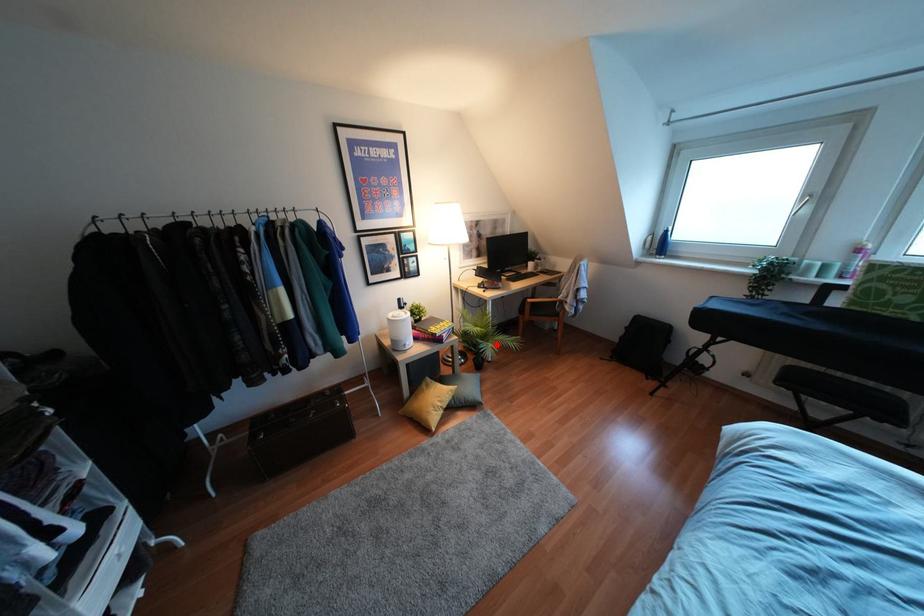
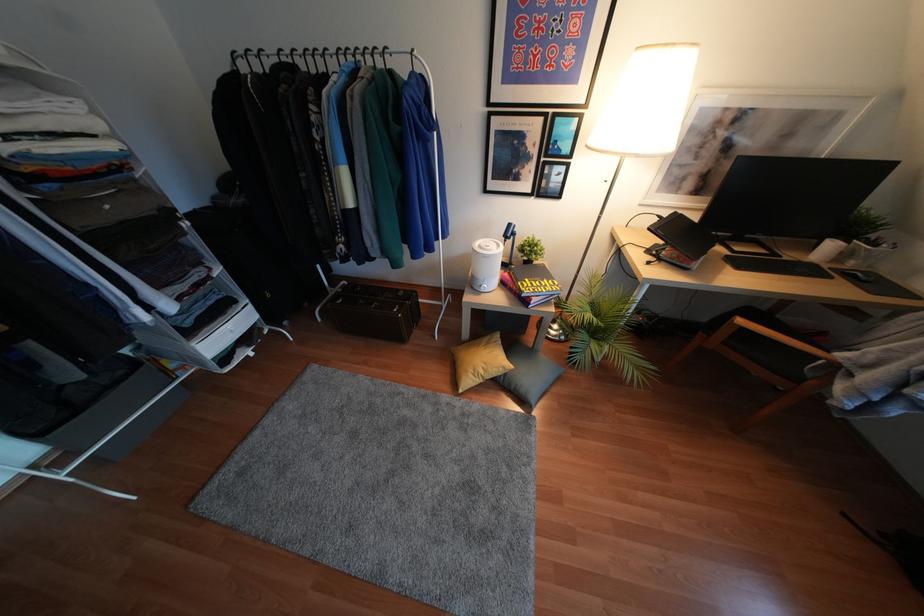
Question: I am providing you with two images of the same scene from different viewpoints. A red point is marked on the first image. Can you still see the location of the red point in image 2?

Choices:
 (A) Yes
 (B) No

Answer: (A)